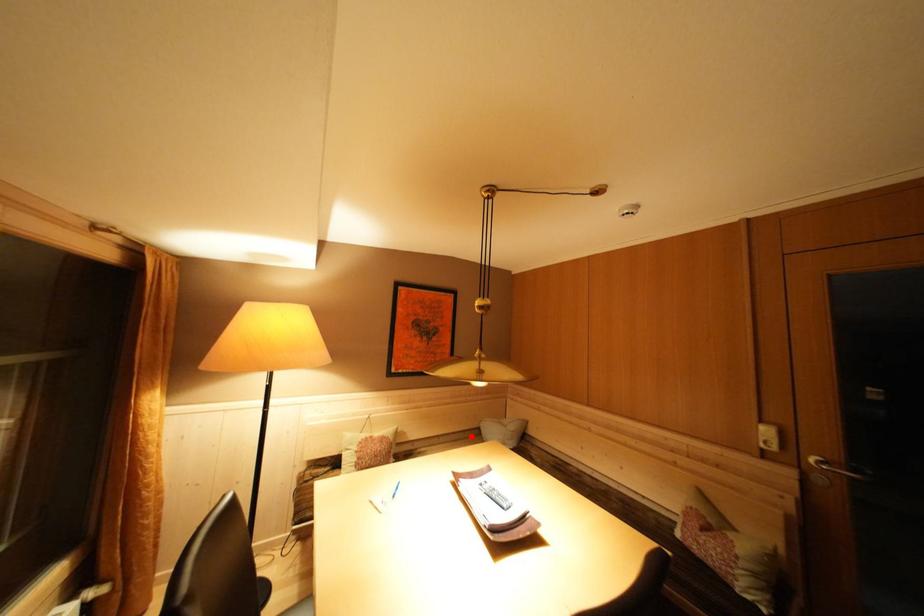
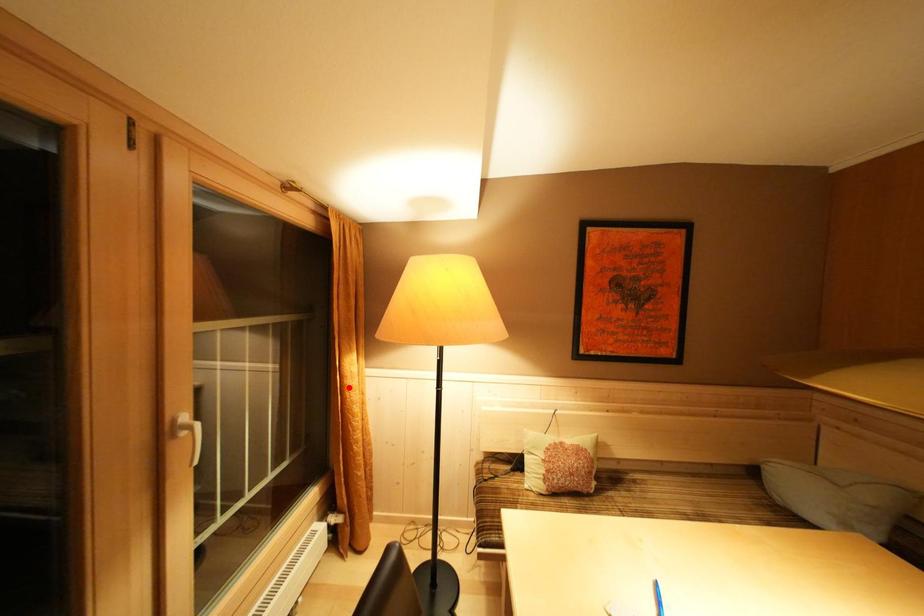
From the picture: I am providing you with two images of the same scene from different viewpoints. A red point is marked on the first image and another point is marked on the second image. Are the points marked in image1 and image2 representing the same 3D position?

No